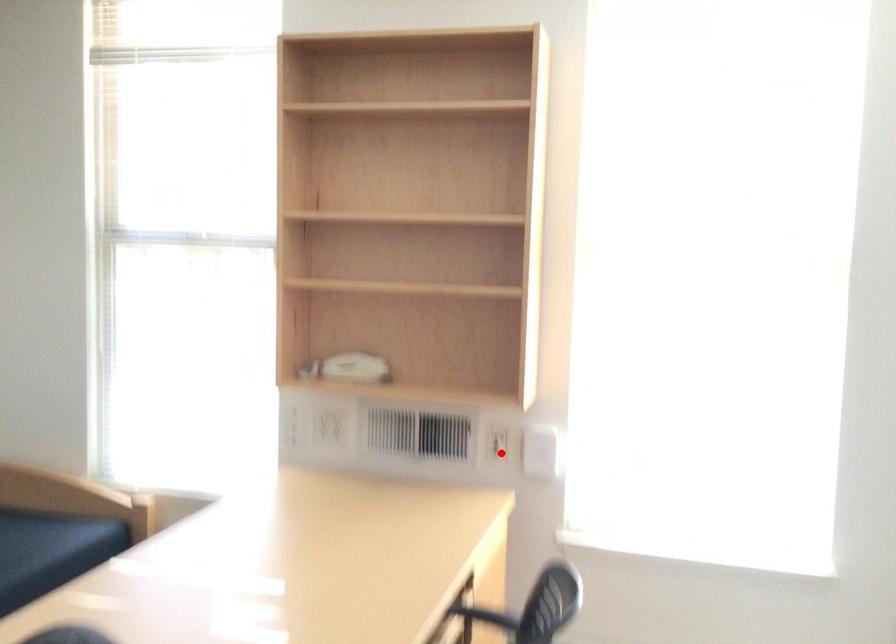
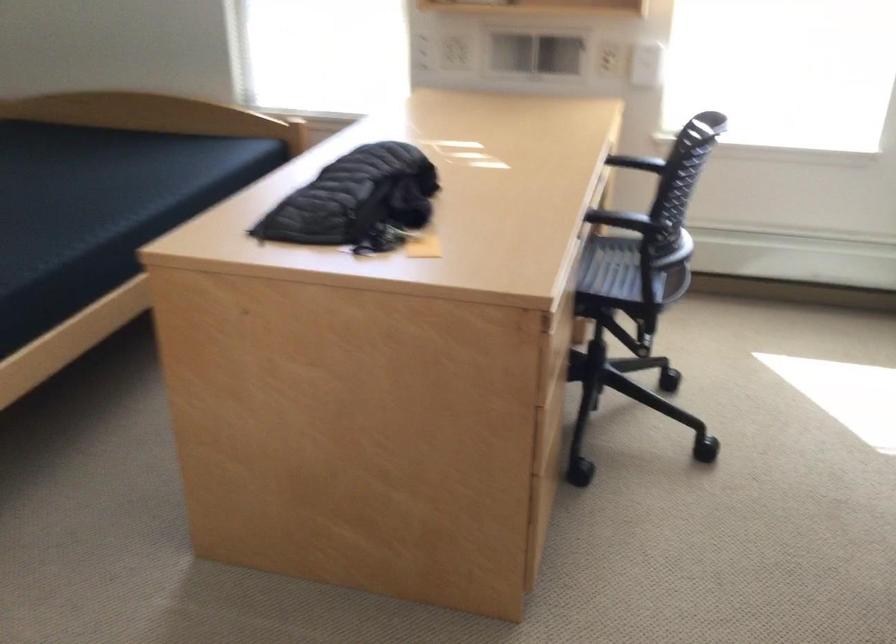
Question: I am providing you with two images of the same scene from different viewpoints. Given a red point in image1, look at the same physical point in image2. Is it:

Choices:
 (A) Closer to the viewpoint
 (B) Farther from the viewpoint

Answer: (B)